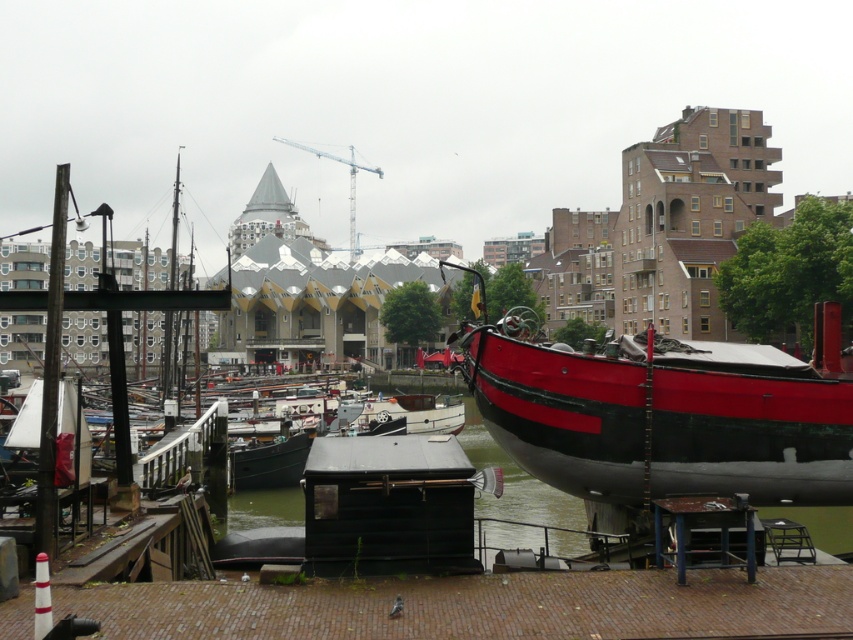
Which is behind, point (817, 484) or point (306, 452)?

Point (306, 452)

Who is lower down, red polished wood boat at right or matte black boat at center?

matte black boat at center is lower down.

Does point (556, 468) come behind point (308, 440)?

That is False.

This screenshot has width=853, height=640. I want to click on red polished wood boat at right, so [660, 416].

The height and width of the screenshot is (640, 853). I want to click on matte black boat at center, so click(270, 458).

Who is positioned more to the right, matte black boat at center or white glossy boat at center?

Positioned to the right is white glossy boat at center.

At what (x,y) coordinates should I click in order to perform the action: click on matte black boat at center. Please return your answer as a coordinate pair (x, y). Image resolution: width=853 pixels, height=640 pixels. Looking at the image, I should click on (270, 458).

You are a GUI agent. You are given a task and a screenshot of the screen. Output one action in this format:
    pyautogui.click(x=<x>, y=<y>)
    Task: Click on the matte black boat at center
    The image size is (853, 640).
    Given the screenshot: What is the action you would take?
    pyautogui.click(x=270, y=458)

Does red polished wood boat at right have a larger size compared to white glossy boat at center?

Yes.

Which is in front, point (788, 387) or point (428, 410)?

Point (788, 387) is in front.

Who is more forward, (747, 404) or (378, 404)?

Point (747, 404) is more forward.

You are a GUI agent. You are given a task and a screenshot of the screen. Output one action in this format:
    pyautogui.click(x=<x>, y=<y>)
    Task: Click on the red polished wood boat at right
    This screenshot has height=640, width=853.
    Given the screenshot: What is the action you would take?
    pyautogui.click(x=660, y=416)